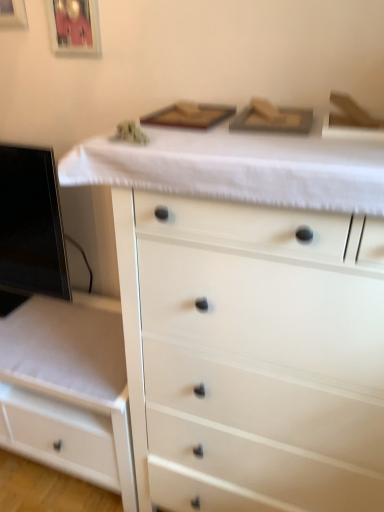
Question: Is point (377, 166) closer or farther from the camera than point (26, 25)?

Choices:
 (A) closer
 (B) farther

Answer: (A)

Question: Looking at the image, does white fabric at upper center seem bigger or smaller compared to metallic silver picture frame at upper left, which appears as the 2th picture frame when viewed from the right?

Choices:
 (A) small
 (B) big

Answer: (B)

Question: Which is farther from the white fabric at upper center?

Choices:
 (A) white glossy drawer at lower left, which is the 2th chest of drawers in right-to-left order
 (B) white matte chest of drawers at center, the second chest of drawers when ordered from left to right
 (C) metallic silver picture frame at upper left, which appears as the 2th picture frame when viewed from the right
 (D) black glossy computer monitor at left
 (E) matte glass picture frame at upper left, the 1th picture frame in the right-to-left sequence

Answer: (C)

Question: Estimate the real-world distances between objects in this image. Which object is farther from the matte glass picture frame at upper left, the 1th picture frame in the right-to-left sequence?

Choices:
 (A) white fabric at upper center
 (B) white glossy drawer at lower left, which is the 2th chest of drawers in right-to-left order
 (C) black glossy computer monitor at left
 (D) white matte chest of drawers at center, the second chest of drawers when ordered from left to right
 (E) metallic silver picture frame at upper left, which appears as the 2th picture frame when viewed from the right

Answer: (B)